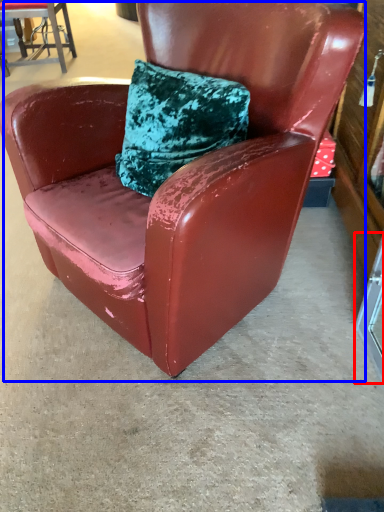
Question: Among these objects, which one is farthest to the camera, glass door (highlighted by a red box) or chair (highlighted by a blue box)?

Choices:
 (A) glass door
 (B) chair

Answer: (A)